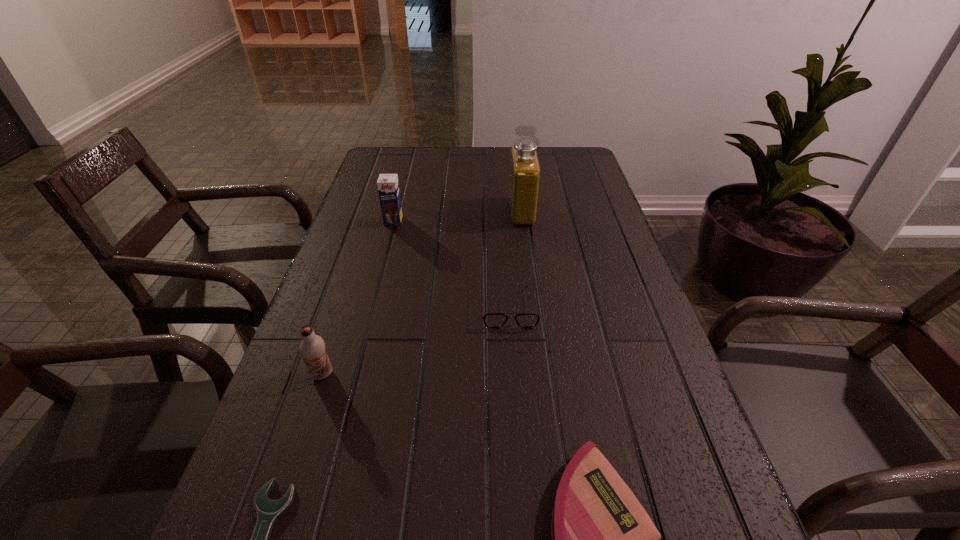
Find the location of a particular element. The image size is (960, 540). object that is the second closest to the fourth nearest object is located at coordinates (603, 539).

I want to click on object that stands as the third closest to the wrench, so click(x=494, y=320).

You are a GUI agent. You are given a task and a screenshot of the screen. Output one action in this format:
    pyautogui.click(x=<x>, y=<y>)
    Task: Click on the vacant space that satisfies the following two spatial constraints: 1. on the front-facing side of the tallest object; 2. on the front label of the third object from left to right
    
    Given the screenshot: What is the action you would take?
    pyautogui.click(x=523, y=221)

Where is `free space in the image that satisfies the following two spatial constraints: 1. on the front-facing side of the perfume; 2. on the front label of the farther chocolate milk`? Image resolution: width=960 pixels, height=540 pixels. free space in the image that satisfies the following two spatial constraints: 1. on the front-facing side of the perfume; 2. on the front label of the farther chocolate milk is located at coordinates (523, 221).

The height and width of the screenshot is (540, 960). Find the location of `vacant area that satisfies the following two spatial constraints: 1. on the front-facing side of the tallest object; 2. on the front-facing side of the third shortest object`. vacant area that satisfies the following two spatial constraints: 1. on the front-facing side of the tallest object; 2. on the front-facing side of the third shortest object is located at coordinates (534, 305).